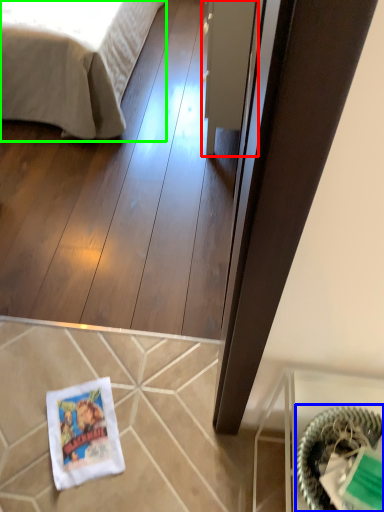
Question: Which object is positioned closest to glass door (highlighted by a red box)? Select from basket (highlighted by a blue box) and bed (highlighted by a green box).

Choices:
 (A) basket
 (B) bed

Answer: (B)